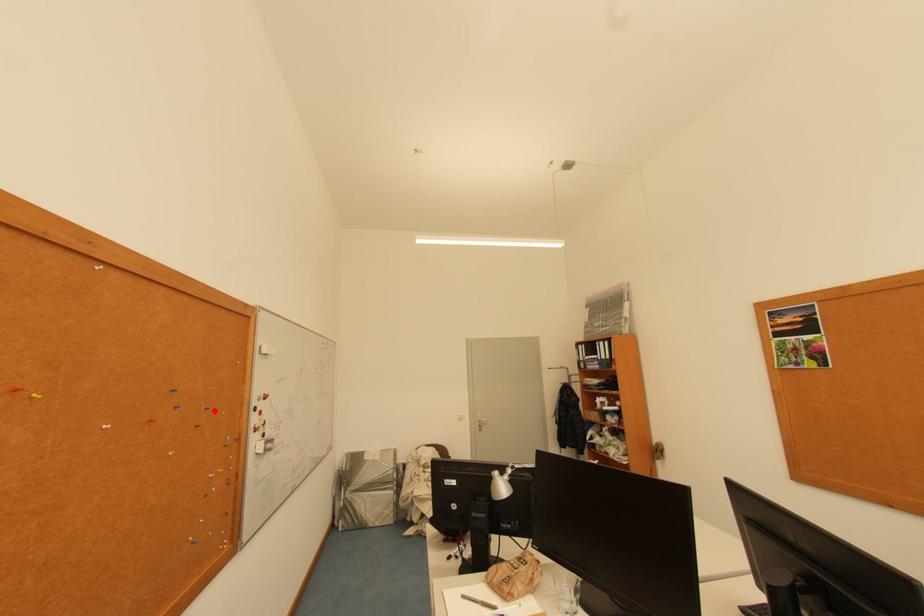
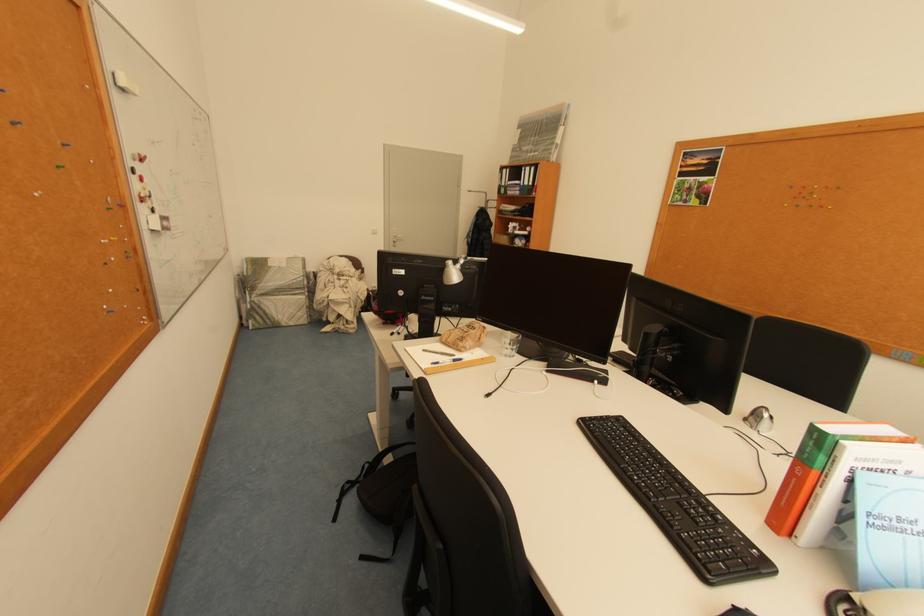
Where in the second image is the point corresponding to the highlighted location from the first image?

(73, 147)